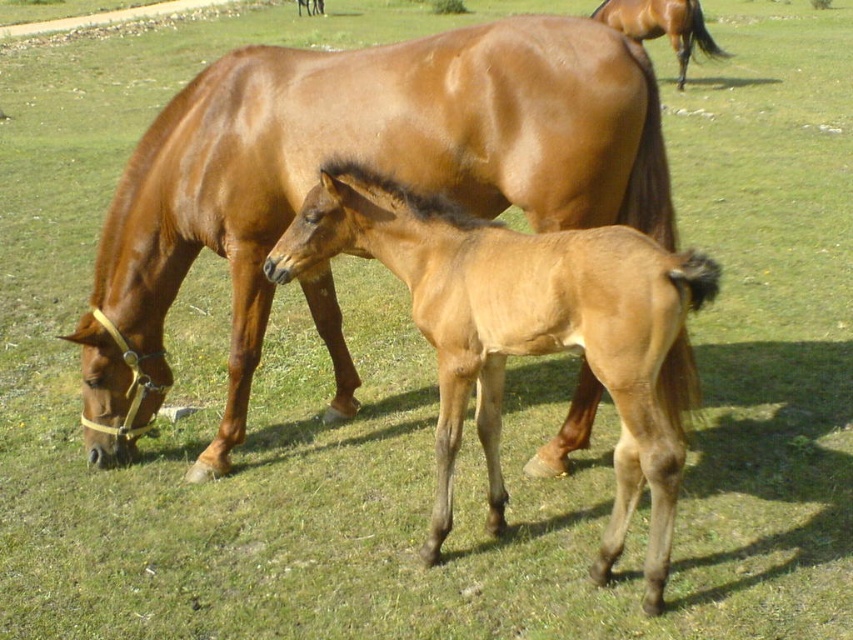
Question: Is glossy brown horse at center to the right of light brown glossy foal at center from the viewer's perspective?

Choices:
 (A) no
 (B) yes

Answer: (A)

Question: Which point appears closest to the camera in this image?

Choices:
 (A) (596, 12)
 (B) (589, 358)

Answer: (B)

Question: Estimate the real-world distances between objects in this image. Which object is farther from the glossy brown horse at center?

Choices:
 (A) light brown glossy foal at center
 (B) brown glossy horse at upper right

Answer: (B)

Question: Can you confirm if light brown glossy foal at center is positioned below brown glossy horse at upper right?

Choices:
 (A) yes
 (B) no

Answer: (A)

Question: Does light brown glossy foal at center appear over brown glossy horse at upper right?

Choices:
 (A) no
 (B) yes

Answer: (A)

Question: Among these objects, which one is farthest from the camera?

Choices:
 (A) brown glossy horse at upper right
 (B) light brown glossy foal at center

Answer: (A)